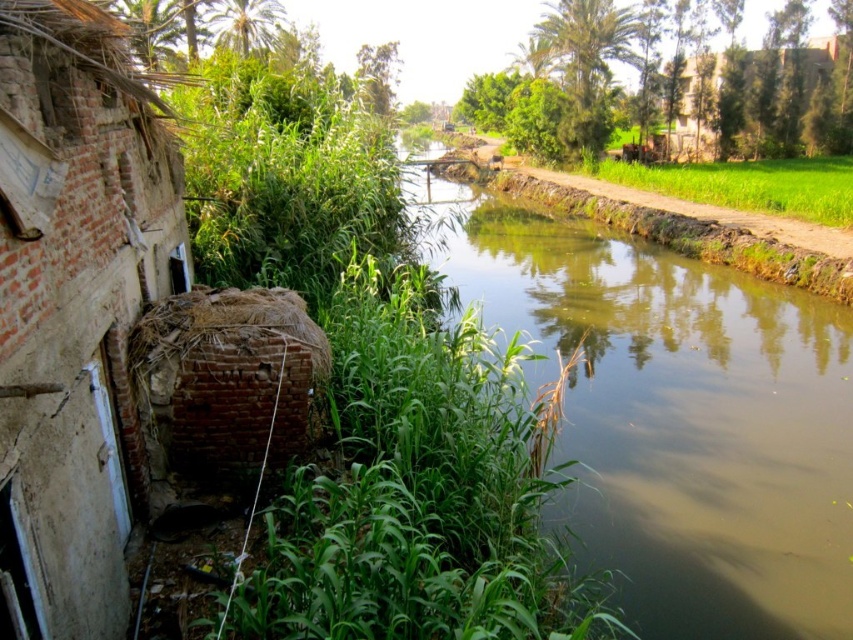
In the scene shown: Does green grassy stream at center have a lesser height compared to green grass at right?

No.

Which is behind, point (796, 564) or point (608, 170)?

Positioned behind is point (608, 170).

The height and width of the screenshot is (640, 853). What are the coordinates of `green grassy stream at center` in the screenshot? It's located at (672, 413).

Is brick wall at left thinner than green grass at right?

Indeed, brick wall at left has a lesser width compared to green grass at right.

Which is above, brick wall at left or green grass at right?

green grass at right

What are the coordinates of `brick wall at left` in the screenshot? It's located at (74, 308).

Between point (798, 77) and point (641, 173), which one is positioned in front?

Point (641, 173) is in front.

Can you confirm if brown brick building at upper right is positioned above green grass at right?

Yes.

Where is `brown brick building at upper right`? The image size is (853, 640). brown brick building at upper right is located at coordinates 746,93.